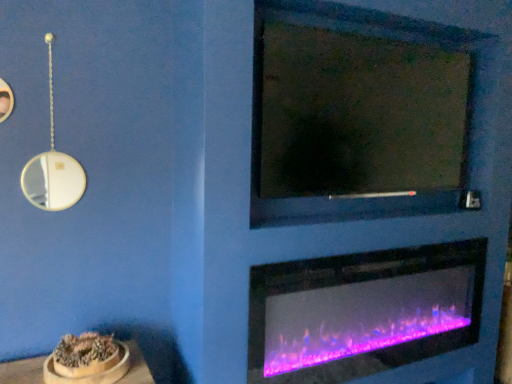
Describe the element at coordinates (342, 113) in the screenshot. I see `matte glass mirror at upper center` at that location.

This screenshot has height=384, width=512. Identify the location of matte glass mirror at upper center. (342, 113).

Image resolution: width=512 pixels, height=384 pixels. Find the location of `purple glass fireplace at lower center`. purple glass fireplace at lower center is located at coordinates (362, 312).

What do you see at coordinates (362, 312) in the screenshot? I see `purple glass fireplace at lower center` at bounding box center [362, 312].

Where is `matte glass mirror at upper center`? matte glass mirror at upper center is located at coordinates (342, 113).

Considering the positions of objects matte glass mirror at upper center and purple glass fireplace at lower center in the image provided, who is more to the right, matte glass mirror at upper center or purple glass fireplace at lower center?

Positioned to the right is purple glass fireplace at lower center.

Considering their positions, is matte glass mirror at upper center located in front of or behind purple glass fireplace at lower center?

Visually, matte glass mirror at upper center is located in front of purple glass fireplace at lower center.

Which point is more forward, (362, 216) or (463, 311)?

The point (362, 216) is in front.

From the image's perspective, between matte glass mirror at upper center and purple glass fireplace at lower center, who is located below?

purple glass fireplace at lower center.

From a real-world perspective, is matte glass mirror at upper center beneath purple glass fireplace at lower center?

Actually, matte glass mirror at upper center is physically above purple glass fireplace at lower center in the real world.

Considering the relative sizes of matte glass mirror at upper center and purple glass fireplace at lower center in the image provided, is matte glass mirror at upper center wider than purple glass fireplace at lower center?

Correct, the width of matte glass mirror at upper center exceeds that of purple glass fireplace at lower center.

Is matte glass mirror at upper center taller than purple glass fireplace at lower center?

Yes, matte glass mirror at upper center is taller than purple glass fireplace at lower center.

Considering the relative sizes of matte glass mirror at upper center and purple glass fireplace at lower center in the image provided, is matte glass mirror at upper center bigger than purple glass fireplace at lower center?

Indeed, matte glass mirror at upper center has a larger size compared to purple glass fireplace at lower center.

Is matte glass mirror at upper center spatially inside purple glass fireplace at lower center, or outside of it?

matte glass mirror at upper center is located beyond the bounds of purple glass fireplace at lower center.

Is matte glass mirror at upper center placed right next to purple glass fireplace at lower center?

No, matte glass mirror at upper center is not next to purple glass fireplace at lower center.

Is matte glass mirror at upper center facing away from purple glass fireplace at lower center?

matte glass mirror at upper center does not have its back to purple glass fireplace at lower center.

How different are the orientations of matte glass mirror at upper center and purple glass fireplace at lower center in degrees?

The facing directions of matte glass mirror at upper center and purple glass fireplace at lower center are 0.376 degrees apart.

Identify the location of mirror in front of the purple glass fireplace at lower center. The height and width of the screenshot is (384, 512). (342, 113).

Would you say purple glass fireplace at lower center is to the left or to the right of matte glass mirror at upper center in the picture?

From the image, it's evident that purple glass fireplace at lower center is to the right of matte glass mirror at upper center.

Is the position of purple glass fireplace at lower center less distant than that of matte glass mirror at upper center?

No, purple glass fireplace at lower center is behind matte glass mirror at upper center.

Between point (282, 285) and point (352, 71), which one is positioned in front?

The point (282, 285) is in front.

From the image's perspective, does purple glass fireplace at lower center appear lower than matte glass mirror at upper center?

Yes, from the image's perspective, purple glass fireplace at lower center is beneath matte glass mirror at upper center.

From a real-world perspective, between purple glass fireplace at lower center and matte glass mirror at upper center, who is vertically higher?

matte glass mirror at upper center.

Considering the sizes of objects purple glass fireplace at lower center and matte glass mirror at upper center in the image provided, who is wider, purple glass fireplace at lower center or matte glass mirror at upper center?

Wider between the two is matte glass mirror at upper center.

Between purple glass fireplace at lower center and matte glass mirror at upper center, which one has more height?

With more height is matte glass mirror at upper center.

Considering the relative sizes of purple glass fireplace at lower center and matte glass mirror at upper center in the image provided, is purple glass fireplace at lower center smaller than matte glass mirror at upper center?

Yes.

Is purple glass fireplace at lower center not within matte glass mirror at upper center?

purple glass fireplace at lower center is positioned outside matte glass mirror at upper center.

Is purple glass fireplace at lower center in contact with matte glass mirror at upper center?

No.

From the picture: Is purple glass fireplace at lower center turned away from matte glass mirror at upper center?

No, purple glass fireplace at lower center's orientation is not away from matte glass mirror at upper center.

Can you tell me how much purple glass fireplace at lower center and matte glass mirror at upper center differ in facing direction?

purple glass fireplace at lower center and matte glass mirror at upper center are facing 0.376 degrees away from each other.

The image size is (512, 384). I want to click on fireplace below the matte glass mirror at upper center (from the image's perspective), so click(x=362, y=312).

Locate an element on the screen. mirror on the left of purple glass fireplace at lower center is located at coordinates (342, 113).

This screenshot has width=512, height=384. I want to click on fireplace that appears on the right of matte glass mirror at upper center, so click(x=362, y=312).